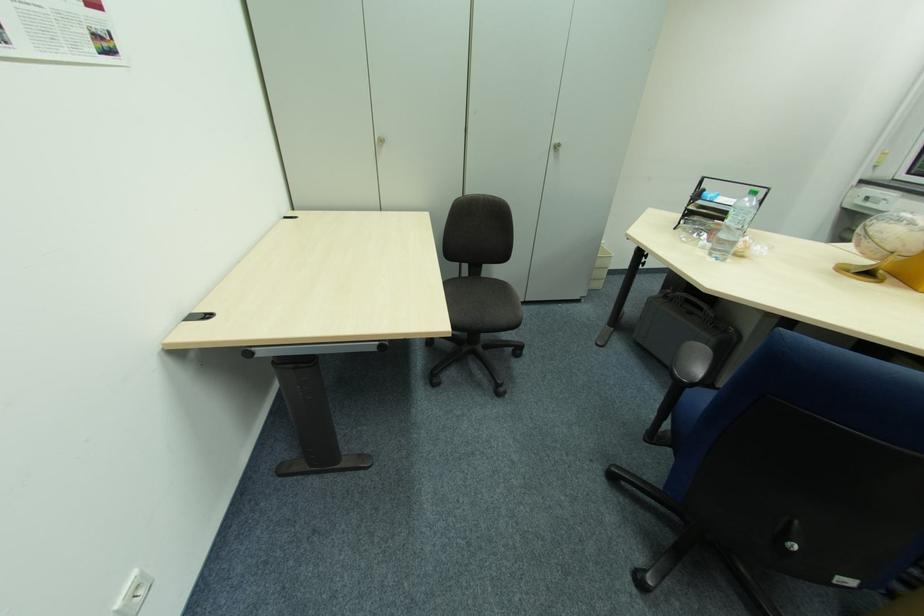
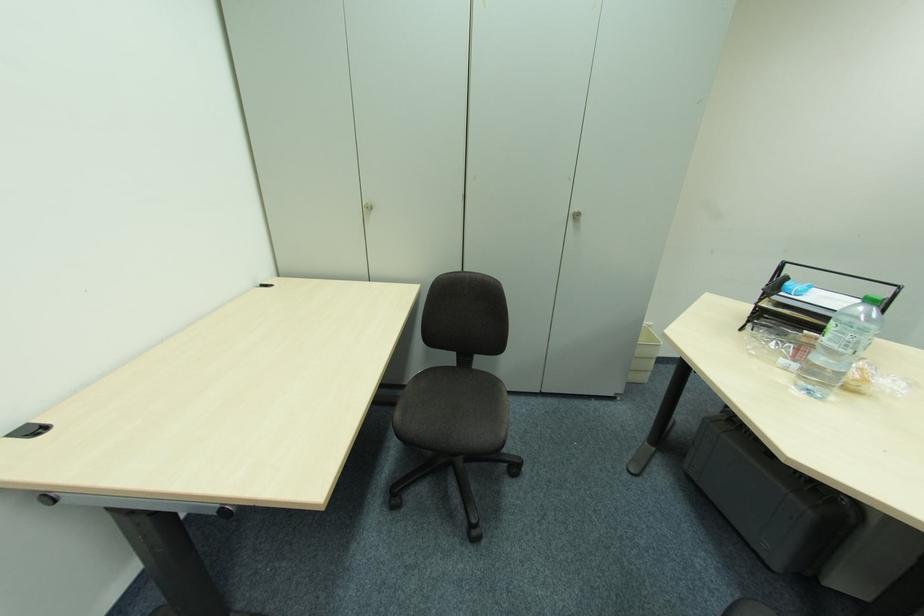
The point at (382, 139) is marked in the first image. Where is the corresponding point in the second image?

(371, 206)